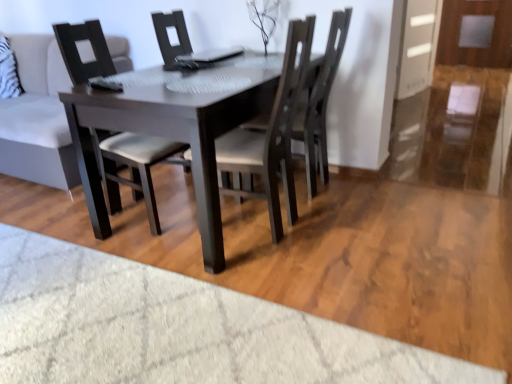
Question: Is light gray fabric couch at upper left to the left or to the right of dark wood chair at center, which ranks as the 1th chair in right-to-left order, in the image?

Choices:
 (A) right
 (B) left

Answer: (B)

Question: From the image's perspective, is light gray fabric couch at upper left located above or below dark wood chair at center, which is counted as the 3th chair, starting from the left?

Choices:
 (A) below
 (B) above

Answer: (B)

Question: Estimate the real-world distances between objects in this image. Which object is closer to the dark wood chair at center, which is counted as the 3th chair, starting from the left?

Choices:
 (A) light gray fabric couch at upper left
 (B) dark wood chair at center, which is counted as the second chair, starting from the right
 (C) dark brown wood table at center
 (D) matte black chair at center, the 3th chair in the right-to-left sequence
 (E) transparent glass door at right

Answer: (B)

Question: Considering the real-world distances, which object is farthest from the transparent glass door at right?

Choices:
 (A) matte black chair at center, which is the 1th chair from left to right
 (B) dark wood chair at center, which is counted as the 3th chair, starting from the left
 (C) dark wood chair at center, which is counted as the second chair, starting from the left
 (D) light gray fabric couch at upper left
 (E) dark brown wood table at center

Answer: (D)